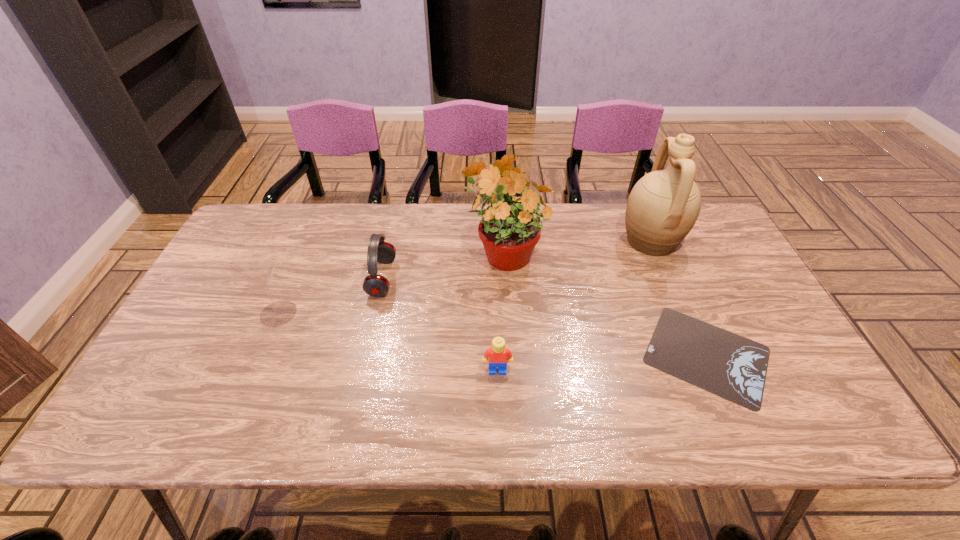
The width and height of the screenshot is (960, 540). What are the coordinates of `pitcher` in the screenshot? It's located at (663, 206).

What are the coordinates of `flowerpot` in the screenshot? It's located at (509, 231).

Find the location of a particular element. This screenshot has height=540, width=960. the fourth shortest object is located at coordinates (257, 265).

Locate an element on the screen. This screenshot has height=540, width=960. the leftmost object is located at coordinates (257, 265).

Locate an element on the screen. the fifth object from right to left is located at coordinates (375, 285).

At what (x,y) coordinates should I click in order to perform the action: click on earphone. Please return your answer as a coordinate pair (x, y). The width and height of the screenshot is (960, 540). Looking at the image, I should click on (x=375, y=285).

Where is `Lego`? Lego is located at coordinates (498, 353).

The width and height of the screenshot is (960, 540). What are the coordinates of `mousepad` in the screenshot? It's located at (726, 364).

The image size is (960, 540). I want to click on blank space located 0.110m on the right of the pitcher, so click(x=718, y=240).

The width and height of the screenshot is (960, 540). Identify the location of vacant space situated 0.350m on the front of the flowerpot. (512, 388).